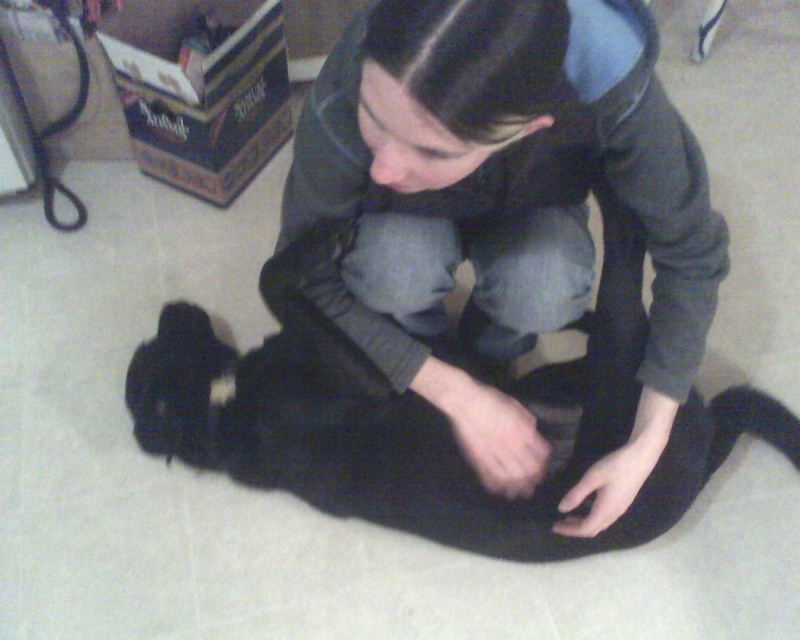
From the picture: Is black fur cat at center bigger than black fur paw at lower center?

Yes, black fur cat at center is bigger than black fur paw at lower center.

Is black fur cat at center above black fur paw at lower center?

Yes.

Between point (390, 429) and point (520, 477), which one is positioned in front?

Positioned in front is point (520, 477).

Identify the location of black fur cat at center. (420, 436).

Is dark gray hoodie at center further to camera compared to black fur paw at lower center?

No, dark gray hoodie at center is in front of black fur paw at lower center.

Between dark gray hoodie at center and black fur paw at lower center, which one appears on the right side from the viewer's perspective?

From the viewer's perspective, black fur paw at lower center appears more on the right side.

Is point (568, 497) positioned after point (506, 481)?

No.

Where is `dark gray hoodie at center`? This screenshot has height=640, width=800. dark gray hoodie at center is located at coordinates (504, 193).

Can you confirm if dark gray hoodie at center is positioned above black fur cat at center?

Yes, dark gray hoodie at center is above black fur cat at center.

You are a GUI agent. You are given a task and a screenshot of the screen. Output one action in this format:
    pyautogui.click(x=<x>, y=<y>)
    Task: Click on the dark gray hoodie at center
    The image size is (800, 640).
    Given the screenshot: What is the action you would take?
    pyautogui.click(x=504, y=193)

I want to click on dark gray hoodie at center, so click(x=504, y=193).